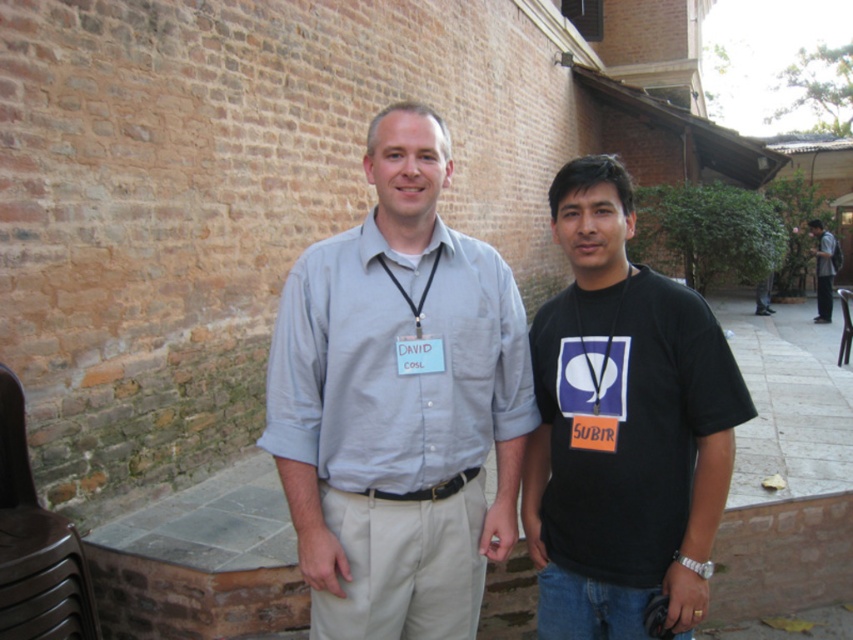
Question: Among these points, which one is farthest from the camera?

Choices:
 (A) (602, 348)
 (B) (824, 257)

Answer: (B)

Question: From the image, what is the correct spatial relationship of black matte t-shirt at center in relation to gray fabric shirt at center?

Choices:
 (A) below
 (B) above

Answer: (A)

Question: From the image, what is the correct spatial relationship of black matte t-shirt at center in relation to gray fabric shirt at center?

Choices:
 (A) right
 (B) left

Answer: (B)

Question: Does light blue cotton shirt at center have a greater width compared to black matte t-shirt at center?

Choices:
 (A) no
 (B) yes

Answer: (B)

Question: Which point appears farthest from the camera in this image?

Choices:
 (A) (828, 252)
 (B) (515, 333)
 (C) (543, 376)

Answer: (A)

Question: Which object is closer to the camera taking this photo?

Choices:
 (A) light blue cotton shirt at center
 (B) gray fabric shirt at center

Answer: (A)